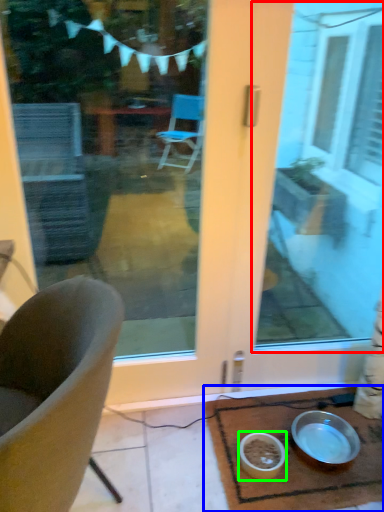
Question: Which is farther away from window screen (highlighted by a red box)? table (highlighted by a blue box) or bowl (highlighted by a green box)?

Choices:
 (A) table
 (B) bowl

Answer: (B)